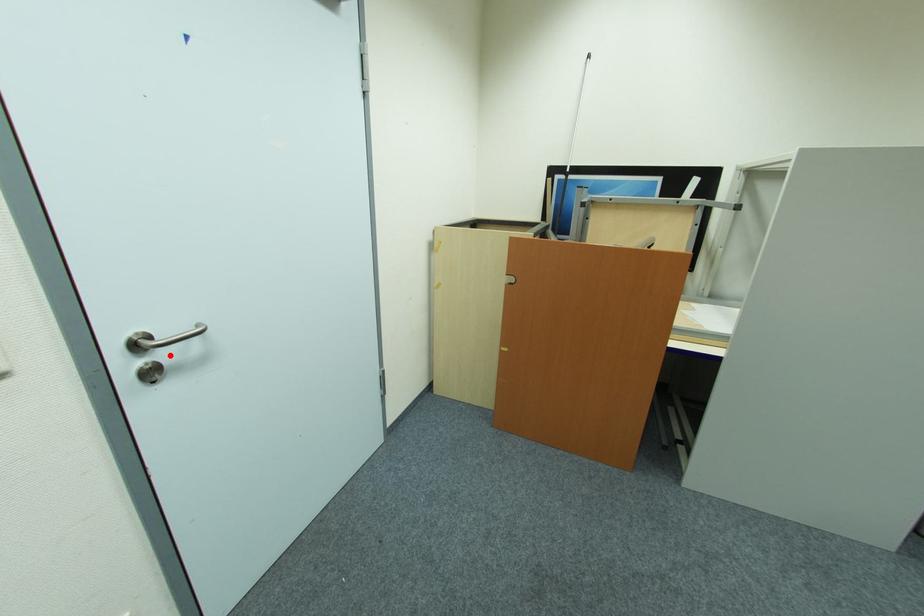
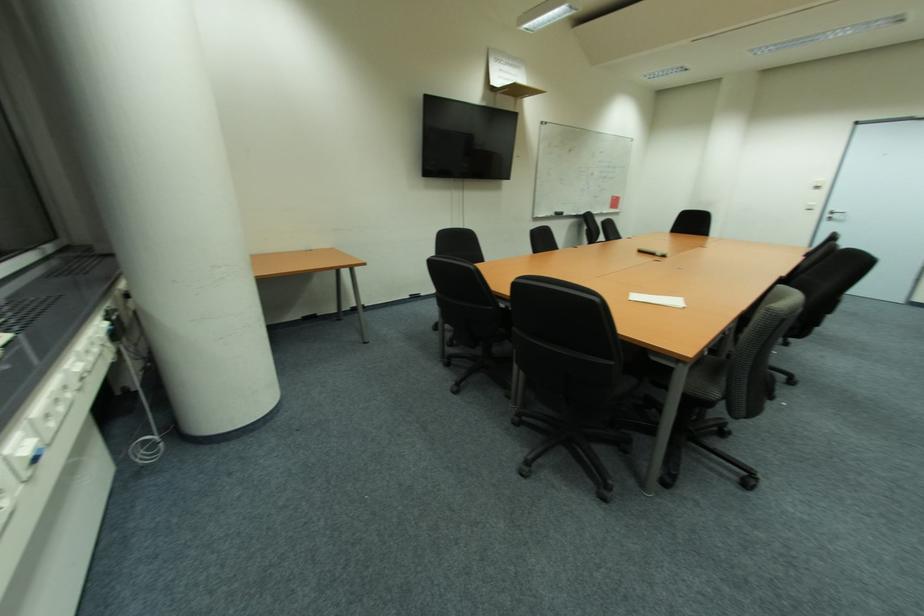
Question: I am providing you with two images of the same scene from different viewpoints. A red point is shown in image1. For the corresponding object point in image2, is it positioned nearer or farther from the camera?

Choices:
 (A) Nearer
 (B) Farther

Answer: (B)